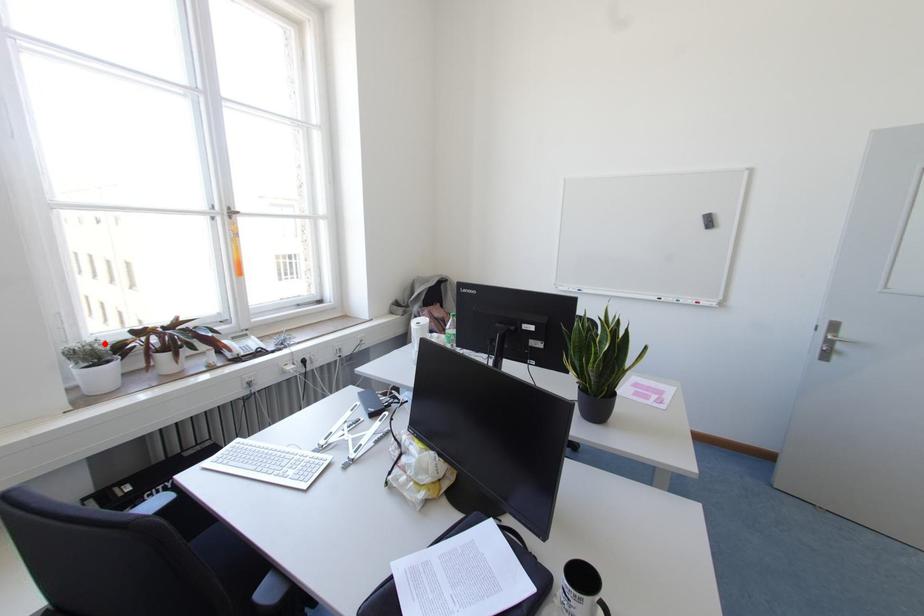
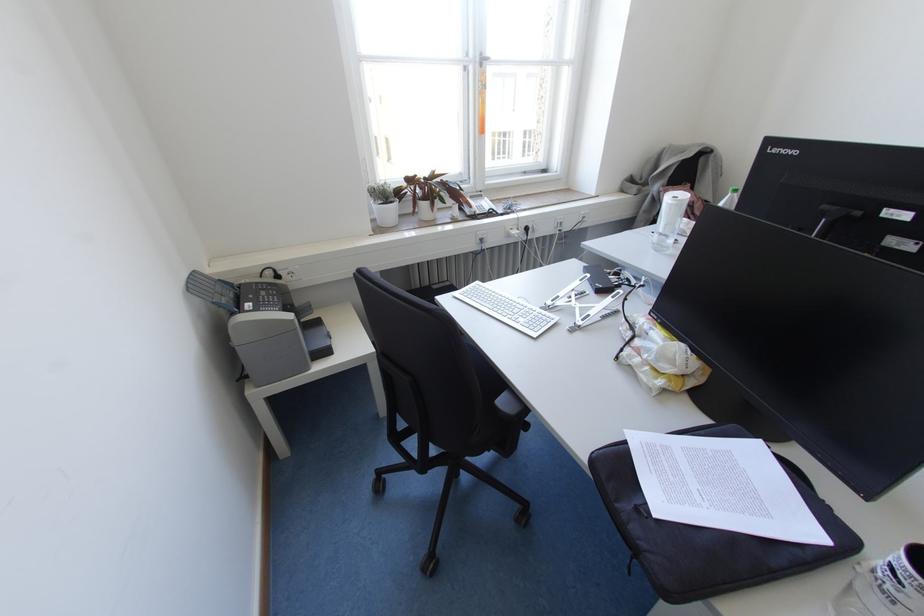
Question: A red point is marked in image1. In image2, is the corresponding 3D point closer to the camera or farther? Reply with the corresponding letter.

Choices:
 (A) The corresponding 3D point is closer.
 (B) The corresponding 3D point is farther.

Answer: (A)